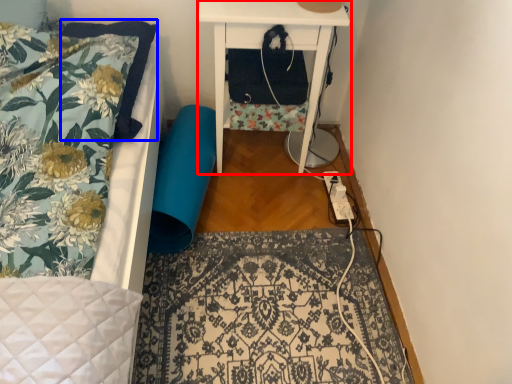
Question: Which point is closer to the camera, nightstand (highlighted by a red box) or pillow (highlighted by a blue box)?

Choices:
 (A) nightstand
 (B) pillow

Answer: (B)